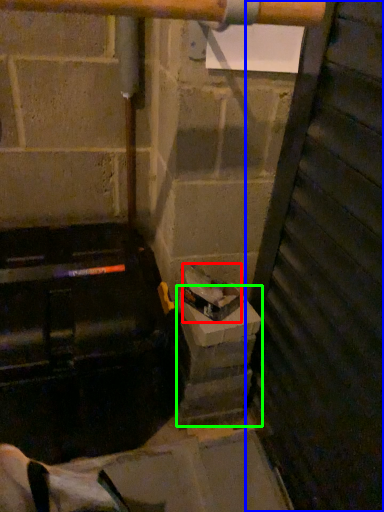
Question: Which is farther away from garbage (highlighted by a red box)? door (highlighted by a blue box) or concrete (highlighted by a green box)?

Choices:
 (A) door
 (B) concrete

Answer: (A)